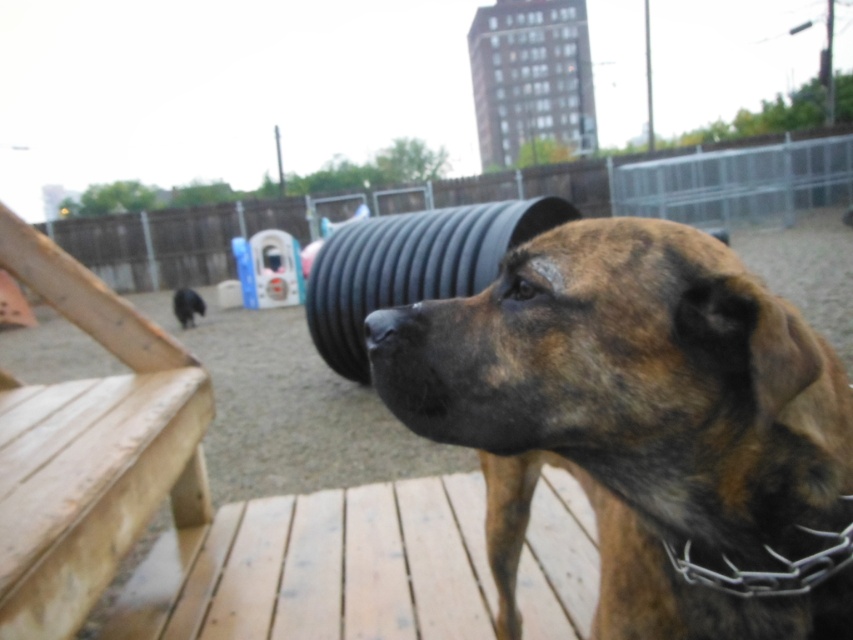
Question: Which of the following is the farthest from the observer?

Choices:
 (A) (612, 348)
 (B) (408, 317)
 (C) (177, 304)

Answer: (C)

Question: Which point is farther to the camera?

Choices:
 (A) (399, 310)
 (B) (401, 285)
 (C) (381, 397)

Answer: (B)

Question: Is black rubber nose at center thinner than brown brindle dog at center?

Choices:
 (A) yes
 (B) no

Answer: (A)

Question: Is brindle fur dog at center to the left of black rubber tire at center from the viewer's perspective?

Choices:
 (A) no
 (B) yes

Answer: (B)

Question: Which is farther from the brown brindle dog at center?

Choices:
 (A) black rubber nose at center
 (B) black rubber tire at center
 (C) brindle fur dog at center

Answer: (A)

Question: Can you confirm if black rubber tire at center is smaller than brown brindle dog at center?

Choices:
 (A) no
 (B) yes

Answer: (B)